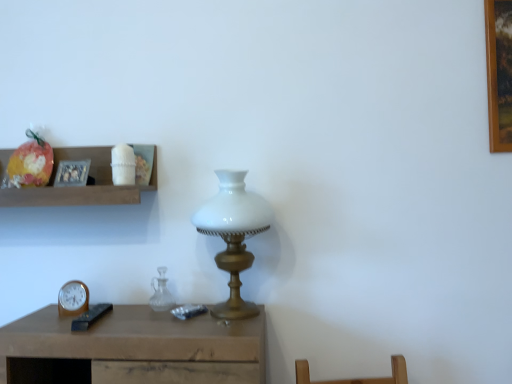
Question: Is shiny plastic bag at upper left oriented towards white glass lamp at center?

Choices:
 (A) yes
 (B) no

Answer: (B)

Question: Considering the relative sizes of shiny plastic bag at upper left and white glass lamp at center in the image provided, is shiny plastic bag at upper left taller than white glass lamp at center?

Choices:
 (A) yes
 (B) no

Answer: (B)

Question: Is shiny plastic bag at upper left turned away from white glass lamp at center?

Choices:
 (A) yes
 (B) no

Answer: (B)

Question: Is shiny plastic bag at upper left far from white glass lamp at center?

Choices:
 (A) no
 (B) yes

Answer: (A)

Question: Considering the relative sizes of shiny plastic bag at upper left and white glass lamp at center in the image provided, is shiny plastic bag at upper left thinner than white glass lamp at center?

Choices:
 (A) no
 (B) yes

Answer: (B)

Question: Are shiny plastic bag at upper left and white glass lamp at center making contact?

Choices:
 (A) no
 (B) yes

Answer: (A)

Question: Is wooden shelf at upper left bigger than shiny plastic bag at upper left?

Choices:
 (A) yes
 (B) no

Answer: (A)

Question: Is wooden shelf at upper left smaller than shiny plastic bag at upper left?

Choices:
 (A) yes
 (B) no

Answer: (B)

Question: Considering the relative positions of wooden shelf at upper left and shiny plastic bag at upper left in the image provided, is wooden shelf at upper left in front of shiny plastic bag at upper left?

Choices:
 (A) no
 (B) yes

Answer: (B)

Question: From the image's perspective, is wooden shelf at upper left located beneath shiny plastic bag at upper left?

Choices:
 (A) yes
 (B) no

Answer: (A)

Question: Considering the relative sizes of wooden shelf at upper left and shiny plastic bag at upper left in the image provided, is wooden shelf at upper left wider than shiny plastic bag at upper left?

Choices:
 (A) no
 (B) yes

Answer: (B)

Question: Would you say wooden shelf at upper left is outside shiny plastic bag at upper left?

Choices:
 (A) no
 (B) yes

Answer: (B)

Question: Is wooden clock at lower left far away from transparent glass vase at center?

Choices:
 (A) no
 (B) yes

Answer: (A)